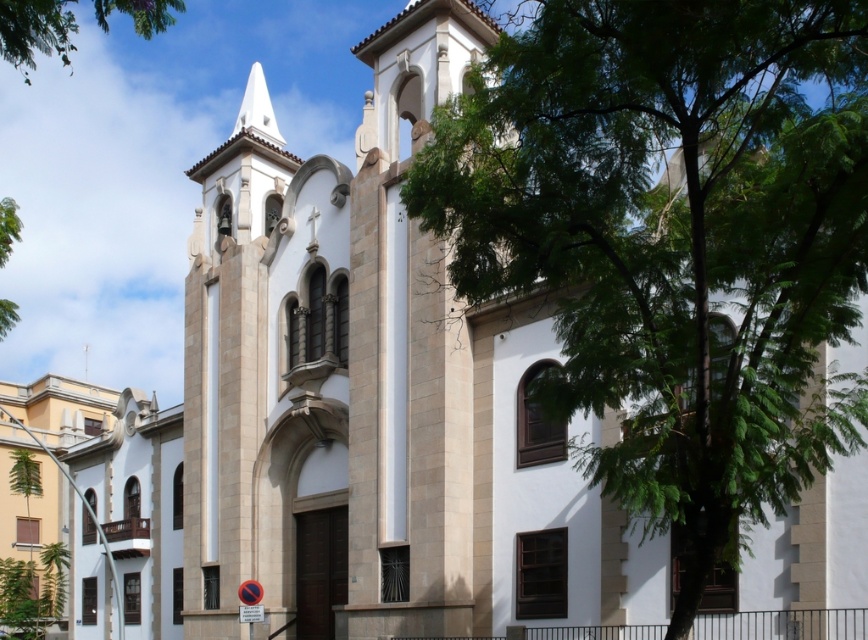
Describe the element at coordinates (673, 243) in the screenshot. I see `green leafy tree at center` at that location.

Based on the photo, between green leafy tree at center and green leafy tree at upper left, which one is positioned lower?

green leafy tree at center

The width and height of the screenshot is (868, 640). Describe the element at coordinates (673, 243) in the screenshot. I see `green leafy tree at center` at that location.

Locate an element on the screen. Image resolution: width=868 pixels, height=640 pixels. green leafy tree at center is located at coordinates (673, 243).

Is point (171, 1) farther from viewer compared to point (239, 131)?

No.

Who is more distant from viewer, (130, 12) or (268, 109)?

The point (268, 109) is more distant.

Which is in front, point (152, 22) or point (268, 118)?

Point (152, 22) is more forward.

The image size is (868, 640). Find the location of `green leafy tree at upper left`. green leafy tree at upper left is located at coordinates (35, 29).

Does green leafy tree at center appear under green leafy tree at left?

Yes.

The height and width of the screenshot is (640, 868). Describe the element at coordinates (673, 243) in the screenshot. I see `green leafy tree at center` at that location.

What do you see at coordinates (673, 243) in the screenshot? I see `green leafy tree at center` at bounding box center [673, 243].

Locate an element on the screen. The width and height of the screenshot is (868, 640). green leafy tree at center is located at coordinates (673, 243).